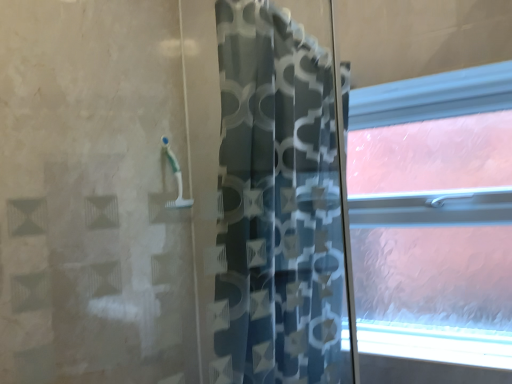
Question: From a real-world perspective, is blue patterned curtain at center over white frosted glass at lower right?

Choices:
 (A) yes
 (B) no

Answer: (A)

Question: Can you confirm if blue patterned curtain at center is bigger than white frosted glass at lower right?

Choices:
 (A) yes
 (B) no

Answer: (A)

Question: From the image's perspective, is blue patterned curtain at center on top of white frosted glass at lower right?

Choices:
 (A) no
 (B) yes

Answer: (B)

Question: From a real-world perspective, is blue patterned curtain at center under white frosted glass at lower right?

Choices:
 (A) no
 (B) yes

Answer: (A)

Question: Does blue patterned curtain at center lie in front of white frosted glass at lower right?

Choices:
 (A) no
 (B) yes

Answer: (B)

Question: Considering the relative sizes of blue patterned curtain at center and white frosted glass at lower right in the image provided, is blue patterned curtain at center thinner than white frosted glass at lower right?

Choices:
 (A) no
 (B) yes

Answer: (A)

Question: Is frosted glass window at right bigger than blue patterned curtain at center?

Choices:
 (A) no
 (B) yes

Answer: (A)

Question: Can you confirm if frosted glass window at right is wider than blue patterned curtain at center?

Choices:
 (A) no
 (B) yes

Answer: (A)

Question: Does frosted glass window at right have a smaller size compared to blue patterned curtain at center?

Choices:
 (A) no
 (B) yes

Answer: (B)

Question: From a real-world perspective, is frosted glass window at right beneath blue patterned curtain at center?

Choices:
 (A) no
 (B) yes

Answer: (B)

Question: Could you tell me if frosted glass window at right is turned towards blue patterned curtain at center?

Choices:
 (A) no
 (B) yes

Answer: (B)

Question: Is frosted glass window at right oriented away from blue patterned curtain at center?

Choices:
 (A) yes
 (B) no

Answer: (B)

Question: Does white frosted glass at lower right have a larger size compared to frosted glass window at right?

Choices:
 (A) yes
 (B) no

Answer: (B)